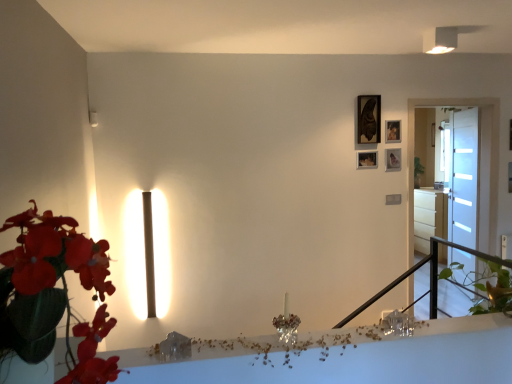
The width and height of the screenshot is (512, 384). Identify the location of vacant space to the right of crystal glass candle at center. (326, 336).